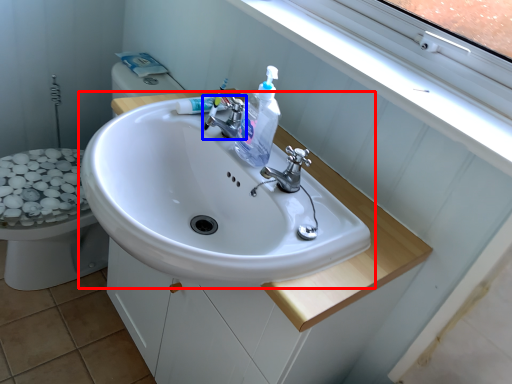
Question: Among these objects, which one is nearest to the camera, sink (highlighted by a red box) or tap (highlighted by a blue box)?

Choices:
 (A) sink
 (B) tap

Answer: (A)